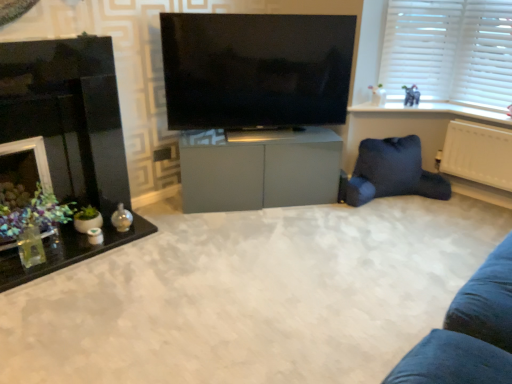
Where is `spots to the right of matte gray cabinet at center`? spots to the right of matte gray cabinet at center is located at coordinates (348, 223).